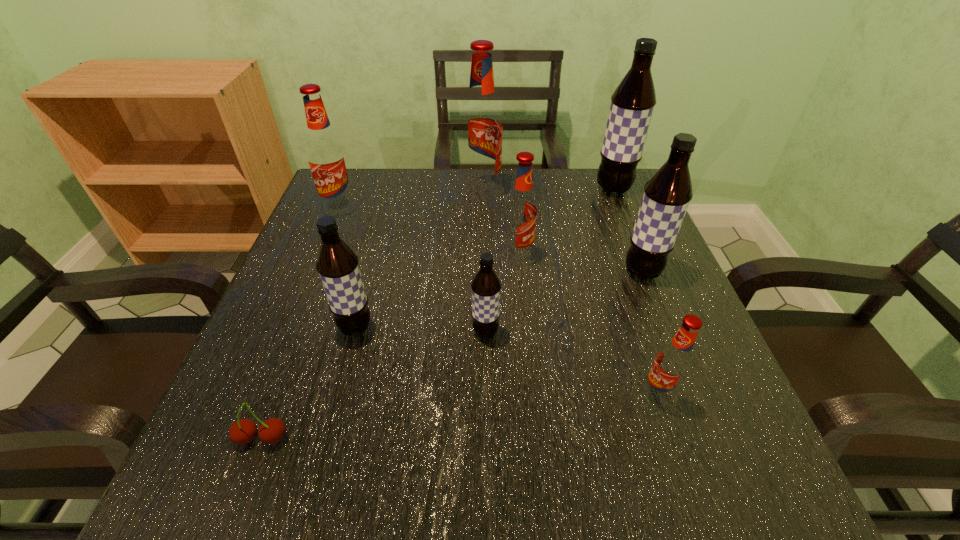
Where is `the farthest brown root beer`? the farthest brown root beer is located at coordinates (632, 103).

Find the location of a particular element. Image resolution: width=960 pixels, height=540 pixels. the biggest red root beer is located at coordinates (481, 125).

The image size is (960, 540). What are the coordinates of `the leftmost red root beer` in the screenshot? It's located at point(326,156).

This screenshot has width=960, height=540. What are the coordinates of `the leftmost root beer` in the screenshot? It's located at (326, 156).

You are a GUI agent. You are given a task and a screenshot of the screen. Output one action in this format:
    pyautogui.click(x=<x>, y=<y>)
    Task: Click on the second farthest brown root beer
    This screenshot has width=960, height=540.
    Given the screenshot: What is the action you would take?
    pyautogui.click(x=667, y=194)

Where is `the second nearest red root beer`? Image resolution: width=960 pixels, height=540 pixels. the second nearest red root beer is located at coordinates (521, 210).

Locate an element on the screen. The width and height of the screenshot is (960, 540). the third object from left to right is located at coordinates (337, 264).

Image resolution: width=960 pixels, height=540 pixels. In order to click on the seventh root beer from right to left in this screenshot , I will do `click(337, 264)`.

You are a GUI agent. You are given a task and a screenshot of the screen. Output one action in this format:
    pyautogui.click(x=<x>, y=<y>)
    Task: Click on the third brown root beer from right to left
    
    Given the screenshot: What is the action you would take?
    pyautogui.click(x=486, y=286)

Identify the location of the eighth farthest object. Image resolution: width=960 pixels, height=540 pixels. (673, 362).